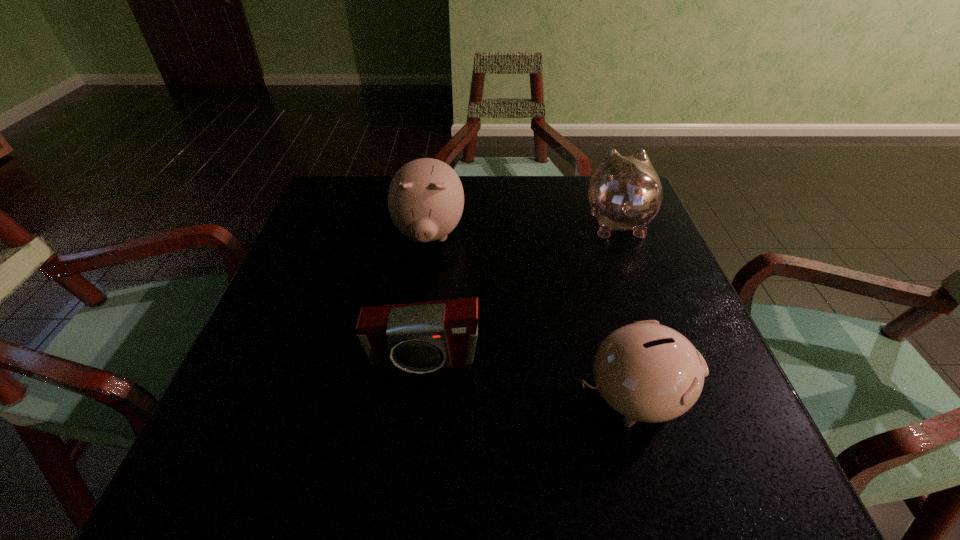
Find the location of a particular element. The width and height of the screenshot is (960, 540). vacant area between the leftmost piggy bank and the camera is located at coordinates (426, 299).

You are a GUI agent. You are given a task and a screenshot of the screen. Output one action in this format:
    pyautogui.click(x=<x>, y=<y>)
    Task: Click on the free space between the leftmost piggy bank and the shortest piggy bank
    This screenshot has height=540, width=960.
    Given the screenshot: What is the action you would take?
    pyautogui.click(x=531, y=316)

This screenshot has width=960, height=540. I want to click on object that is the closest to the camera, so click(647, 372).

Locate which object is the second closest to the leftmost piggy bank. Please provide its 2D coordinates. Your answer should be formatted as a tuple, i.e. [(x, y)], where the tuple contains the x and y coordinates of a point satisfying the conditions above.

[(625, 192)]

Identify the location of the second closest piggy bank to the shortest piggy bank. (625, 192).

This screenshot has width=960, height=540. Identify the location of piggy bank that is the second closest one to the leftmost piggy bank. (647, 372).

The height and width of the screenshot is (540, 960). I want to click on vacant space that satisfies the following two spatial constraints: 1. on the front-facing side of the nearest piggy bank; 2. on the right side of the camera, so click(x=419, y=398).

Identify the location of free space that satisfies the following two spatial constraints: 1. on the front-facing side of the camera; 2. on the left side of the shortest piggy bank. point(419,398).

Where is `vacant position in the image that satisfies the following two spatial constraints: 1. at the snout of the leftmost piggy bank; 2. on the right side of the nearest piggy bank`? vacant position in the image that satisfies the following two spatial constraints: 1. at the snout of the leftmost piggy bank; 2. on the right side of the nearest piggy bank is located at coordinates (407, 398).

I want to click on vacant area that satisfies the following two spatial constraints: 1. on the front-facing side of the nearest piggy bank; 2. on the right side of the camera, so click(419, 398).